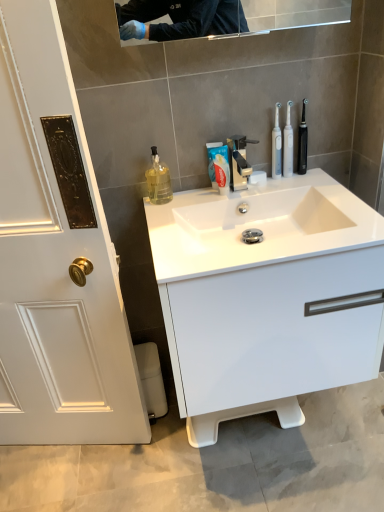
Locate an element on the screen. empty space that is in between white glossy toothpaste at center and translucent glass mouthwash at left, which is the second mouthwash in right-to-left order is located at coordinates (189, 196).